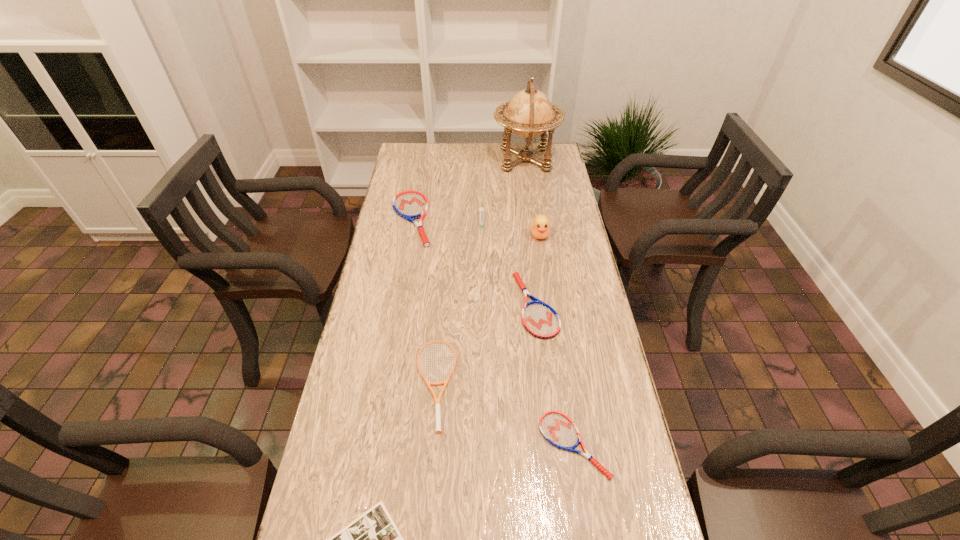
Identify the location of the farthest object. (529, 113).

Locate an element on the screen. This screenshot has height=540, width=960. the tallest object is located at coordinates (529, 113).

Identify the location of duckling. (540, 227).

At what (x,y) coordinates should I click in order to perform the action: click on the second tallest object. Please return your answer as a coordinate pair (x, y). The height and width of the screenshot is (540, 960). Looking at the image, I should click on (540, 227).

Image resolution: width=960 pixels, height=540 pixels. What are the coordinates of `the tallest tennis racket` in the screenshot? It's located at click(x=410, y=205).

Identify the location of the biggest blue tennis racket. (410, 205).

Find the location of `the fifth object from right to left`. the fifth object from right to left is located at coordinates (481, 210).

Locate an element on the screen. This screenshot has height=540, width=960. syringe is located at coordinates (481, 210).

Image resolution: width=960 pixels, height=540 pixels. Identify the location of the third nearest tennis racket. (540, 320).

This screenshot has height=540, width=960. What are the coordinates of `the second nearest blue tennis racket` in the screenshot? It's located at (540, 320).